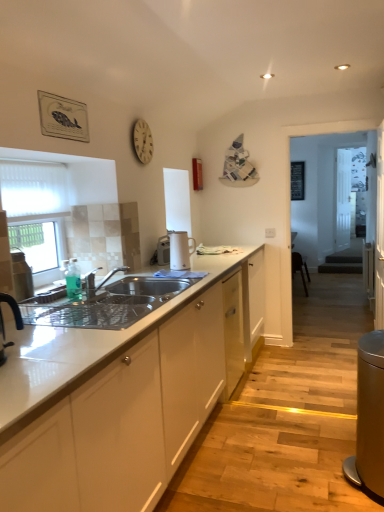
Question: Can we say satin silver sink at center lies outside white mesh screen at left?

Choices:
 (A) no
 (B) yes

Answer: (B)

Question: Does satin silver sink at center appear on the right side of white mesh screen at left?

Choices:
 (A) no
 (B) yes

Answer: (B)

Question: Would you say white mesh screen at left is part of satin silver sink at center's contents?

Choices:
 (A) no
 (B) yes

Answer: (A)

Question: Is satin silver sink at center not near white mesh screen at left?

Choices:
 (A) no
 (B) yes

Answer: (A)

Question: Does satin silver sink at center have a greater width compared to white mesh screen at left?

Choices:
 (A) no
 (B) yes

Answer: (B)

Question: Considering the positions of point (99, 314) and point (137, 130), is point (99, 314) closer or farther from the camera than point (137, 130)?

Choices:
 (A) closer
 (B) farther

Answer: (A)

Question: Is satin silver sink at center in front of or behind wooden clock at upper center in the image?

Choices:
 (A) front
 (B) behind

Answer: (A)

Question: In the image, is satin silver sink at center on the left side or the right side of wooden clock at upper center?

Choices:
 (A) left
 (B) right

Answer: (A)

Question: Choose the correct answer: Is satin silver sink at center inside wooden clock at upper center or outside it?

Choices:
 (A) outside
 (B) inside

Answer: (A)

Question: Would you say satin silver sink at center is to the left or to the right of clear glass door at center, which is the first glass door in back-to-front order, in the picture?

Choices:
 (A) left
 (B) right

Answer: (A)

Question: From a real-world perspective, is satin silver sink at center positioned above or below clear glass door at center, which is the first glass door in back-to-front order?

Choices:
 (A) below
 (B) above

Answer: (A)

Question: Looking at their shapes, would you say satin silver sink at center is wider or thinner than clear glass door at center, which is the 2th glass door from front to back?

Choices:
 (A) wide
 (B) thin

Answer: (A)

Question: Is point (142, 313) positioned closer to the camera than point (337, 220)?

Choices:
 (A) closer
 (B) farther

Answer: (A)

Question: From a real-world perspective, is satin silver sink at center positioned above or below white glossy electric kettle at center, which is the first appliance from back to front?

Choices:
 (A) above
 (B) below

Answer: (B)

Question: In terms of width, does satin silver sink at center look wider or thinner when compared to white glossy electric kettle at center, placed as the 2th appliance when sorted from front to back?

Choices:
 (A) thin
 (B) wide

Answer: (B)